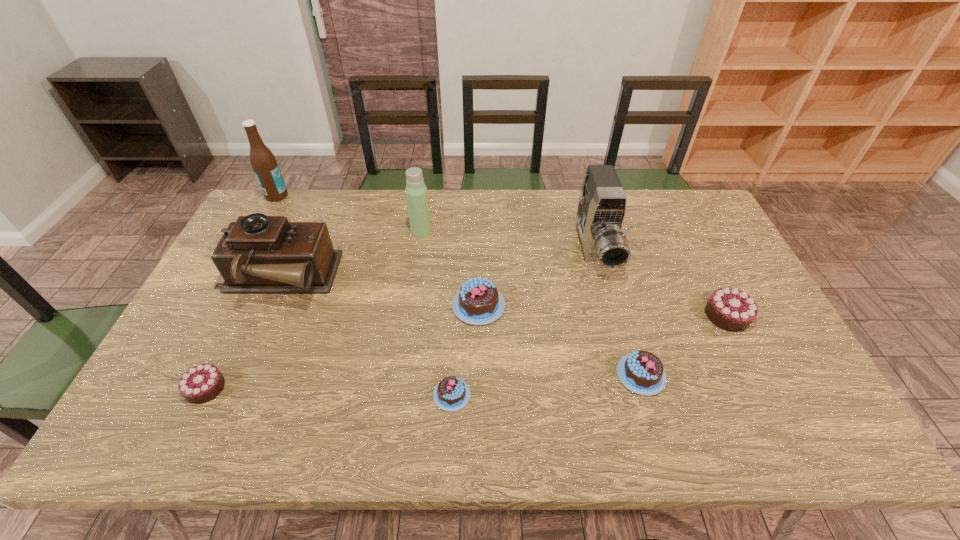
Find the location of a particular element. This screenshot has height=540, width=960. chocolate cake that is at the left edge is located at coordinates (200, 384).

Find the location of a particular element. The width and height of the screenshot is (960, 540). object located in the right edge section of the desktop is located at coordinates (733, 310).

Find the location of a particular element. This screenshot has width=960, height=540. object present at the far left corner is located at coordinates (264, 164).

In the image, there is a desktop. Where is `vacant space at the far edge`? The image size is (960, 540). vacant space at the far edge is located at coordinates (663, 224).

Find the location of a particular element. The width and height of the screenshot is (960, 540). free region at the near edge of the desktop is located at coordinates (252, 422).

The height and width of the screenshot is (540, 960). In the image, there is a desktop. In order to click on free space at the left edge in this screenshot , I will do `click(205, 340)`.

Where is `free space at the far left corner`? The image size is (960, 540). free space at the far left corner is located at coordinates (298, 195).

Where is `free space at the far right corner of the desktop`? This screenshot has height=540, width=960. free space at the far right corner of the desktop is located at coordinates (680, 226).

Find the location of a particular element. free spot between the fourth tallest object and the thermos bottle is located at coordinates (348, 255).

Locate an element on the screen. Image resolution: width=960 pixels, height=540 pixels. free space between the leftmost chocolate cake and the second biggest pink chocolate cake is located at coordinates (423, 381).